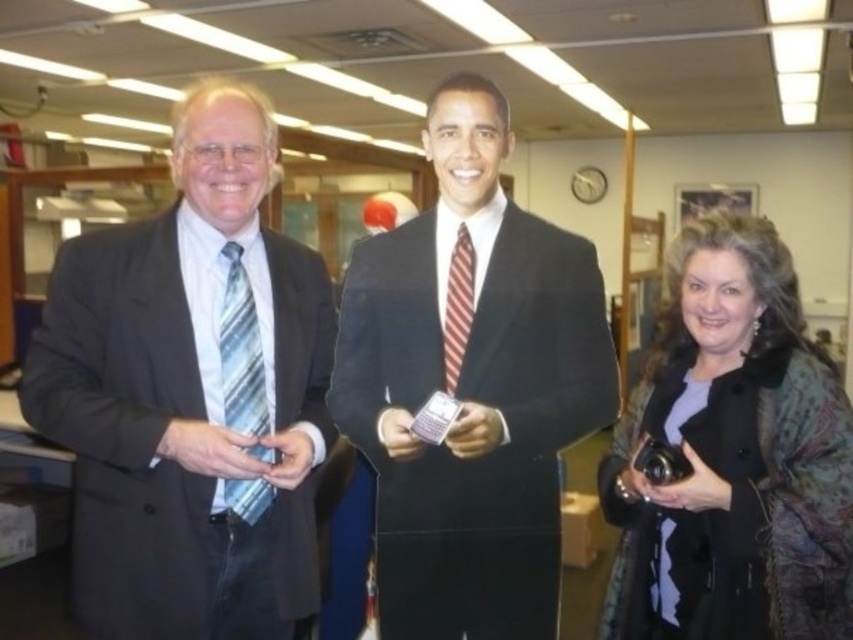
Who is shorter, matte black suit at left or black velvet suit at center?

With less height is matte black suit at left.

Is matte black suit at left closer to camera compared to black velvet suit at center?

Yes, matte black suit at left is closer to the viewer.

Does point (215, 358) lie in front of point (592, 364)?

Yes, point (215, 358) is closer to viewer.

At what (x,y) coordinates should I click in order to perform the action: click on matte black suit at left. Please return your answer as a coordinate pair (x, y). Image resolution: width=853 pixels, height=640 pixels. Looking at the image, I should click on (190, 394).

Between black velvet suit at center and black textured coat at lower right, which one is positioned lower?

black textured coat at lower right

Locate an element on the screen. black velvet suit at center is located at coordinates (471, 385).

I want to click on black velvet suit at center, so click(x=471, y=385).

Can you confirm if matte black suit at left is positioned above black textured coat at lower right?

Yes.

Is matte black suit at left positioned before black textured coat at lower right?

That is True.

Is point (122, 237) closer to camera compared to point (737, 358)?

That is True.

Where is `matte black suit at left`? matte black suit at left is located at coordinates (190, 394).